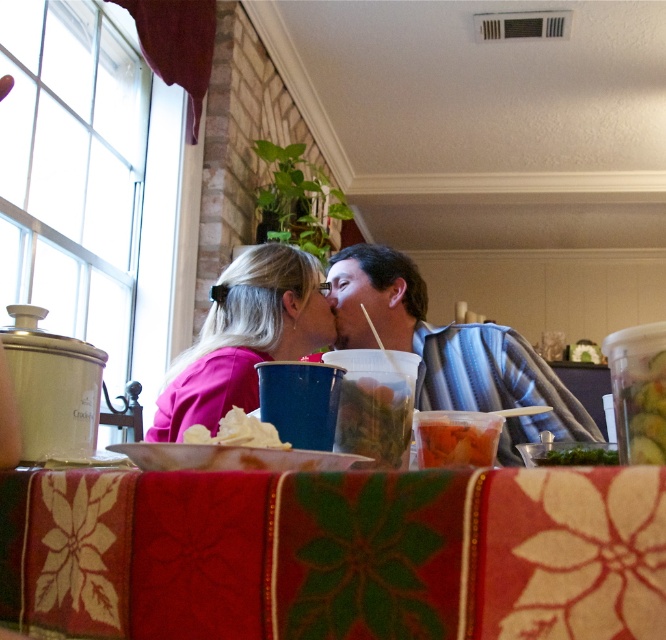
Can you confirm if translucent plastic container at center is wider than white crumpled paper at center?

Indeed, translucent plastic container at center has a greater width compared to white crumpled paper at center.

Where is `translucent plastic container at center`? The width and height of the screenshot is (666, 640). translucent plastic container at center is located at coordinates (456, 438).

Describe the element at coordinates (456, 438) in the screenshot. The width and height of the screenshot is (666, 640). I see `translucent plastic container at center` at that location.

Where is `translucent plastic container at center`? translucent plastic container at center is located at coordinates pyautogui.click(x=456, y=438).

Does christmas-patterned fabric at lower center appear over pink matte shirt at center?

No, christmas-patterned fabric at lower center is not above pink matte shirt at center.

Between christmas-patterned fabric at lower center and pink matte shirt at center, which one has less height?

christmas-patterned fabric at lower center is shorter.

Measure the distance between point (645,476) and camera.

Point (645,476) and camera are 19.09 inches apart from each other.

I want to click on christmas-patterned fabric at lower center, so click(x=400, y=554).

Does smooth blue shirt at center appear under translucent plastic container at center?

Incorrect, smooth blue shirt at center is not positioned below translucent plastic container at center.

Who is positioned more to the right, smooth blue shirt at center or translucent plastic container at center?

From the viewer's perspective, smooth blue shirt at center appears more on the right side.

What do you see at coordinates (450, 349) in the screenshot?
I see `smooth blue shirt at center` at bounding box center [450, 349].

At what (x,y) coordinates should I click in order to perform the action: click on smooth blue shirt at center. Please return your answer as a coordinate pair (x, y). The image size is (666, 640). Looking at the image, I should click on (x=450, y=349).